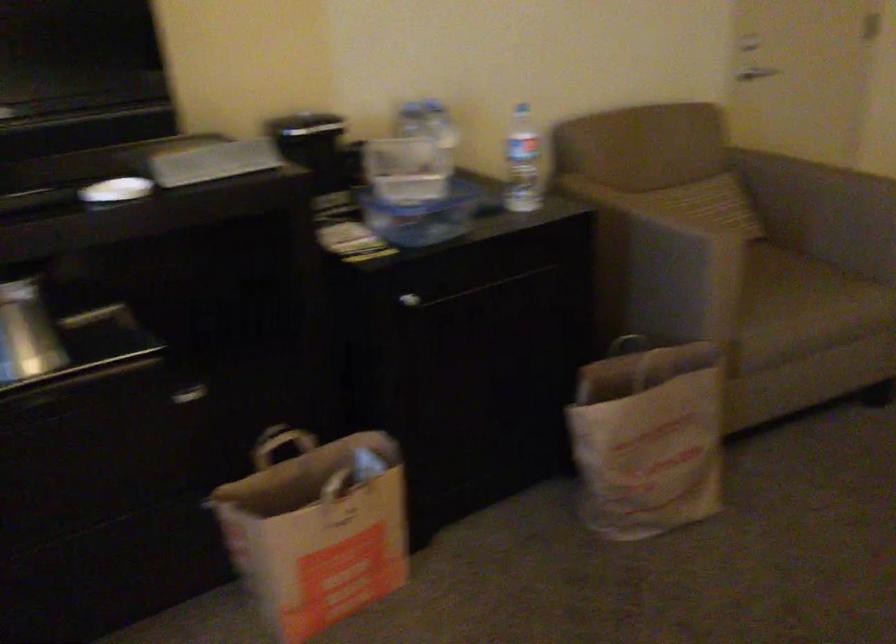
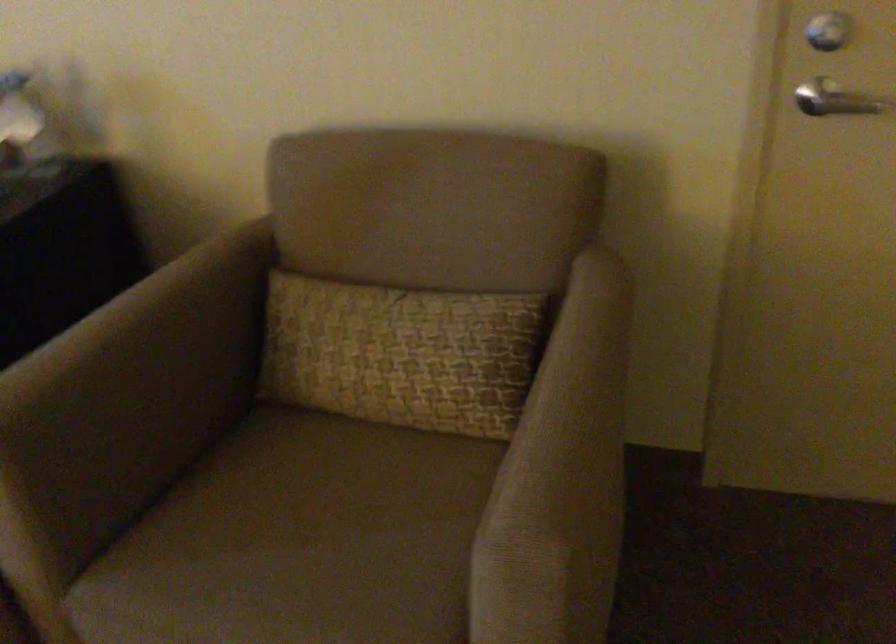
In the second image, find the point that corresponds to [712,204] in the first image.

(401, 353)